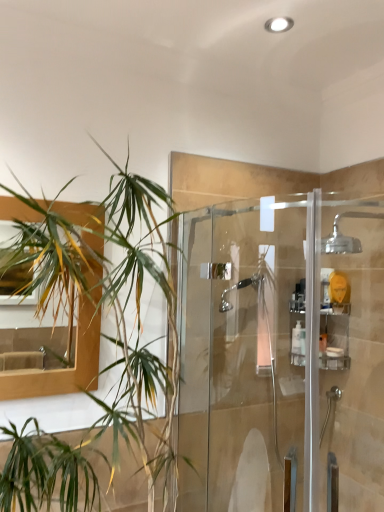
Question: Does clear glass shower door at center have a smaller size compared to chrome metallic showerhead at upper right?

Choices:
 (A) no
 (B) yes

Answer: (A)

Question: Considering the relative sizes of clear glass shower door at center and chrome metallic showerhead at upper right in the image provided, is clear glass shower door at center taller than chrome metallic showerhead at upper right?

Choices:
 (A) yes
 (B) no

Answer: (A)

Question: Does clear glass shower door at center appear on the left side of chrome metallic showerhead at upper right?

Choices:
 (A) no
 (B) yes

Answer: (B)

Question: Is clear glass shower door at center wider than chrome metallic showerhead at upper right?

Choices:
 (A) no
 (B) yes

Answer: (A)

Question: Is clear glass shower door at center oriented away from chrome metallic showerhead at upper right?

Choices:
 (A) no
 (B) yes

Answer: (B)

Question: Is chrome metallic showerhead at upper right taller or shorter than green leafy plant at left?

Choices:
 (A) short
 (B) tall

Answer: (A)

Question: Is chrome metallic showerhead at upper right in front of or behind green leafy plant at left in the image?

Choices:
 (A) front
 (B) behind

Answer: (B)

Question: From a real-world perspective, relative to green leafy plant at left, is chrome metallic showerhead at upper right vertically above or below?

Choices:
 (A) above
 (B) below

Answer: (A)

Question: Looking at their shapes, would you say chrome metallic showerhead at upper right is wider or thinner than green leafy plant at left?

Choices:
 (A) wide
 (B) thin

Answer: (B)

Question: Is green leafy plant at left to the left or to the right of clear glass shower door at center in the image?

Choices:
 (A) left
 (B) right

Answer: (A)

Question: Is green leafy plant at left in front of or behind clear glass shower door at center in the image?

Choices:
 (A) behind
 (B) front

Answer: (B)

Question: From a real-world perspective, is green leafy plant at left physically located above or below clear glass shower door at center?

Choices:
 (A) above
 (B) below

Answer: (A)

Question: From the image's perspective, is green leafy plant at left positioned above or below clear glass shower door at center?

Choices:
 (A) above
 (B) below

Answer: (A)

Question: In the image, is green leafy plant at left positioned in front of or behind white plastic bottle at center?

Choices:
 (A) front
 (B) behind

Answer: (A)

Question: From a real-world perspective, is green leafy plant at left physically located above or below white plastic bottle at center?

Choices:
 (A) below
 (B) above

Answer: (B)